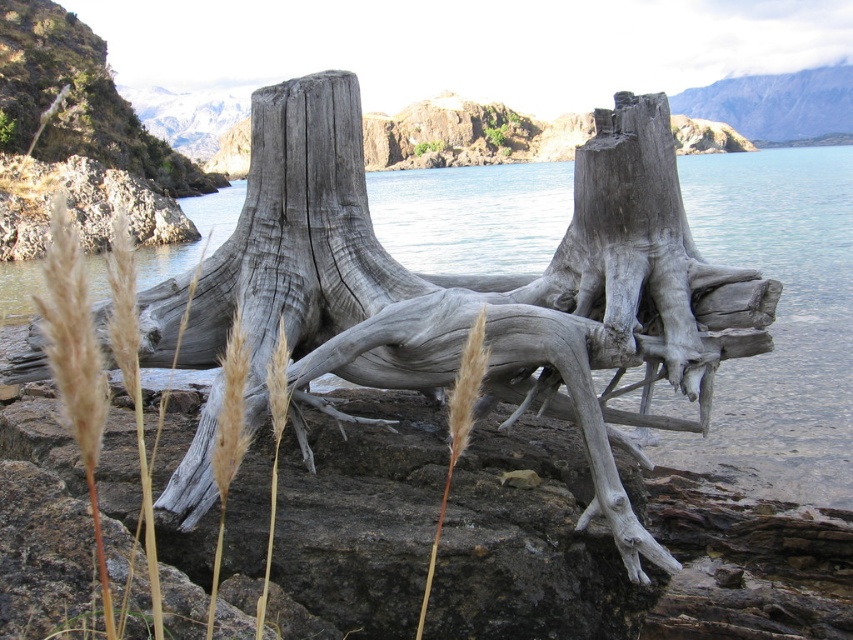
Where is `clear blue water at center`? This screenshot has width=853, height=640. clear blue water at center is located at coordinates (779, 323).

Can you confirm if clear blue water at center is thinner than brown fuzzy grass at center?

No, clear blue water at center is not thinner than brown fuzzy grass at center.

What do you see at coordinates (779, 323) in the screenshot?
I see `clear blue water at center` at bounding box center [779, 323].

Image resolution: width=853 pixels, height=640 pixels. I want to click on clear blue water at center, so click(779, 323).